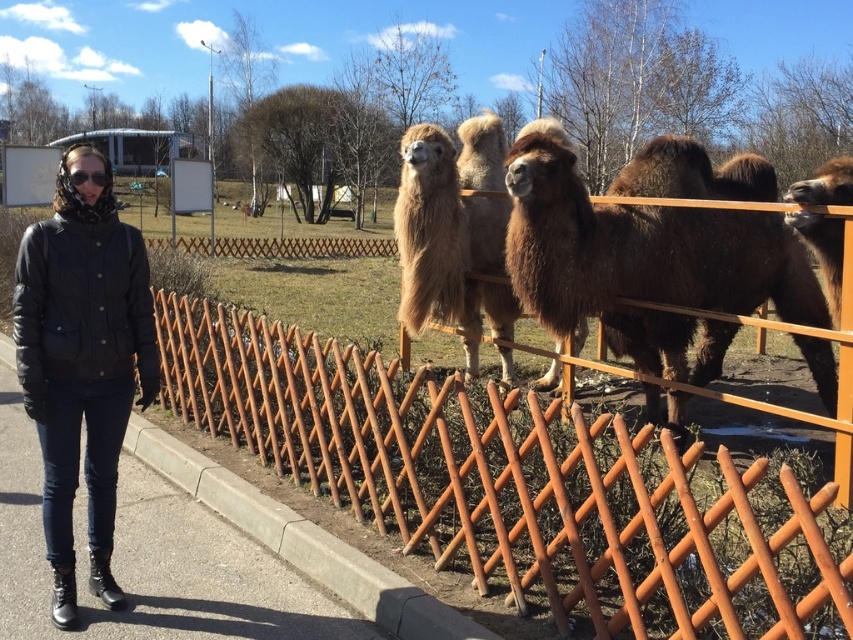
Question: Estimate the real-world distances between objects in this image. Which object is closer to the black quilted jacket at left?

Choices:
 (A) clear plastic goggles at upper left
 (B) fuzzy brown alpaca at center
 (C) rusty wood fence at center

Answer: (A)

Question: Which point is farther from the camera taking this photo?

Choices:
 (A) (380, 525)
 (B) (65, 236)
 (C) (78, 170)

Answer: (A)

Question: Which point is closer to the camera taking this photo?

Choices:
 (A) (82, 179)
 (B) (322, 472)
 (C) (432, 296)

Answer: (A)

Question: Does rusty wood fence at center appear on the right side of black quilted jacket at left?

Choices:
 (A) no
 (B) yes

Answer: (B)

Question: Is rusty wood fence at center in front of black quilted jacket at left?

Choices:
 (A) no
 (B) yes

Answer: (B)

Question: Can you confirm if rusty wood fence at center is bigger than fuzzy brown alpaca at center?

Choices:
 (A) yes
 (B) no

Answer: (A)